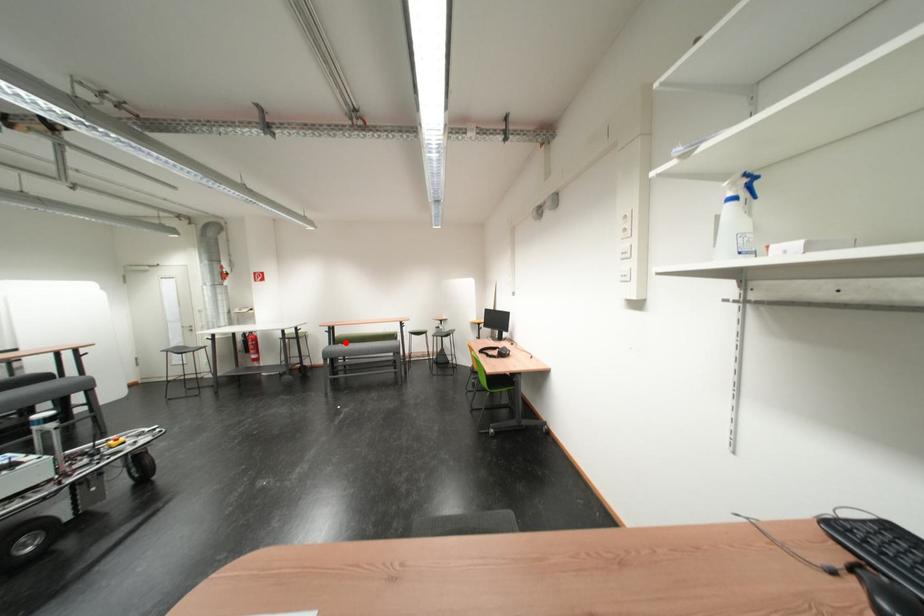
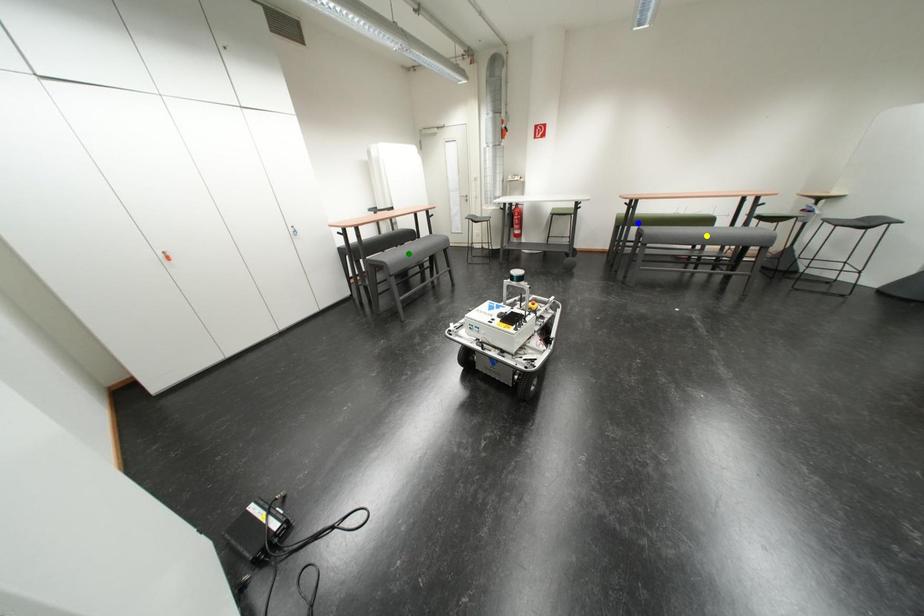
Question: I am providing you with two images of the same scene from different viewpoints. A red point is marked on the first image. You are given multiple points on the second image. Can you choose the point in image 2 that corresponds to the point in image 1?

Choices:
 (A) yellow point
 (B) blue point
 (C) green point

Answer: (B)